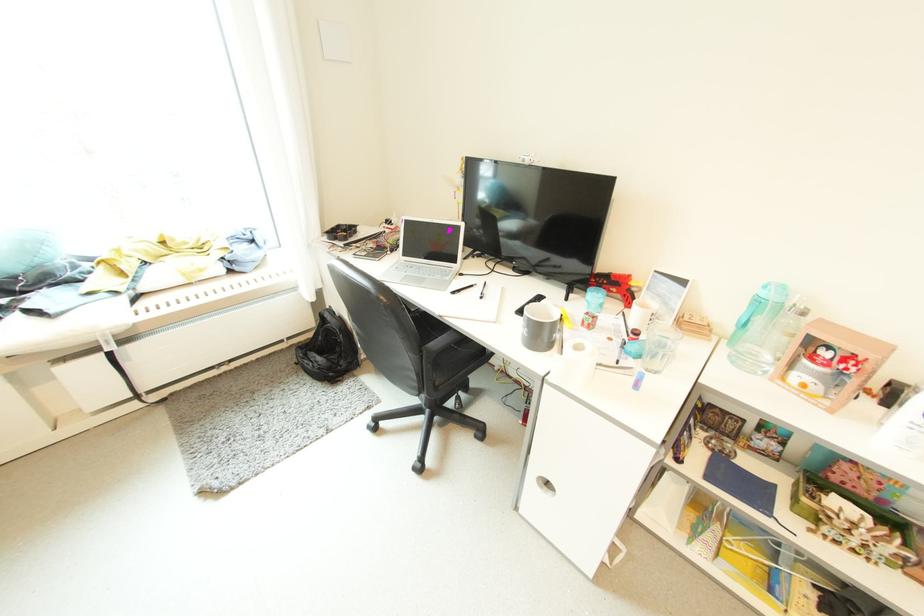
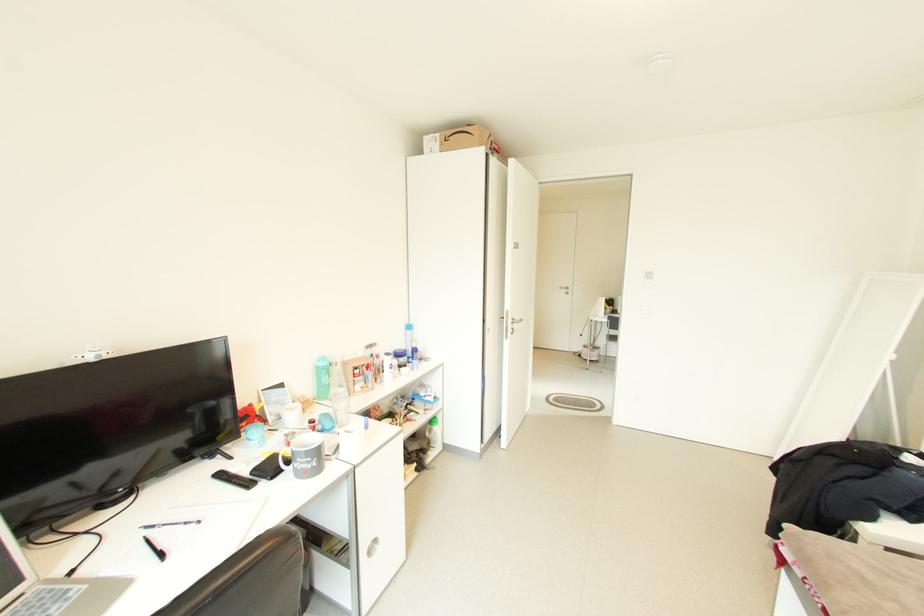
The point at (477, 286) is marked in the first image. Where is the corresponding point in the second image?

(152, 541)